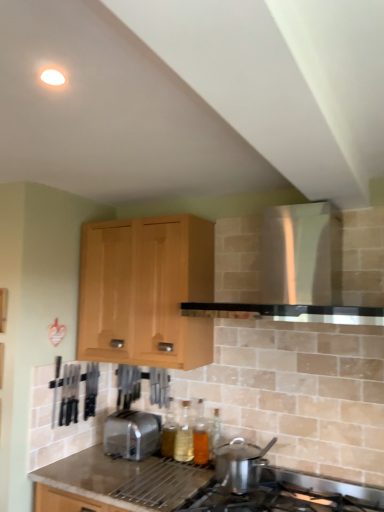
You are a GUI agent. You are given a task and a screenshot of the screen. Output one action in this format:
    pyautogui.click(x=<x>, y=<y>)
    Task: Click on the empty space that is ontop of white glossy vent at upper center (from a real-world perspective)
    
    Given the screenshot: What is the action you would take?
    pyautogui.click(x=253, y=180)